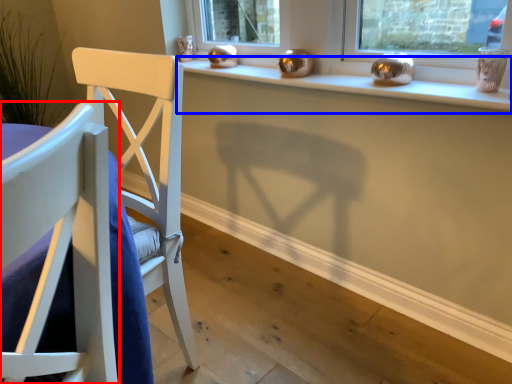
Question: Which object appears farthest to the camera in this image, chair (highlighted by a red box) or window sill (highlighted by a blue box)?

Choices:
 (A) chair
 (B) window sill

Answer: (B)